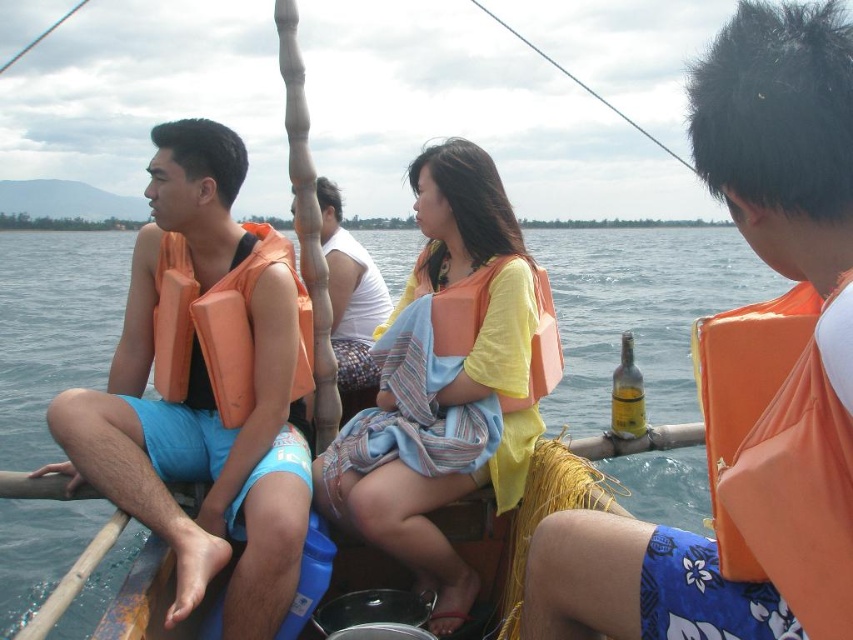
Does orange life vest at center have a larger size compared to orange fabric life jacket at center?

Indeed, orange life vest at center has a larger size compared to orange fabric life jacket at center.

How much distance is there between orange life vest at center and orange fabric life jacket at center?

A distance of 2.02 meters exists between orange life vest at center and orange fabric life jacket at center.

Between point (341, 353) and point (440, 317), which one is positioned behind?

The point (341, 353) is more distant.

Image resolution: width=853 pixels, height=640 pixels. Identify the location of orange life vest at center. (350, 300).

Between point (77, 298) and point (387, 307), which one is positioned behind?

Point (77, 298)

Based on the photo, can you confirm if transparent blue water at center is bigger than orange life vest at center?

Yes, transparent blue water at center is bigger than orange life vest at center.

Image resolution: width=853 pixels, height=640 pixels. What do you see at coordinates (640, 307) in the screenshot?
I see `transparent blue water at center` at bounding box center [640, 307].

This screenshot has width=853, height=640. I want to click on transparent blue water at center, so click(x=640, y=307).

Does orange foam life jacket at right appear over orange life vest at center?

Incorrect, orange foam life jacket at right is not positioned above orange life vest at center.

Which is behind, point (720, 369) or point (363, 339)?

Positioned behind is point (363, 339).

Locate an element on the screen. The image size is (853, 640). orange foam life jacket at right is located at coordinates (744, 392).